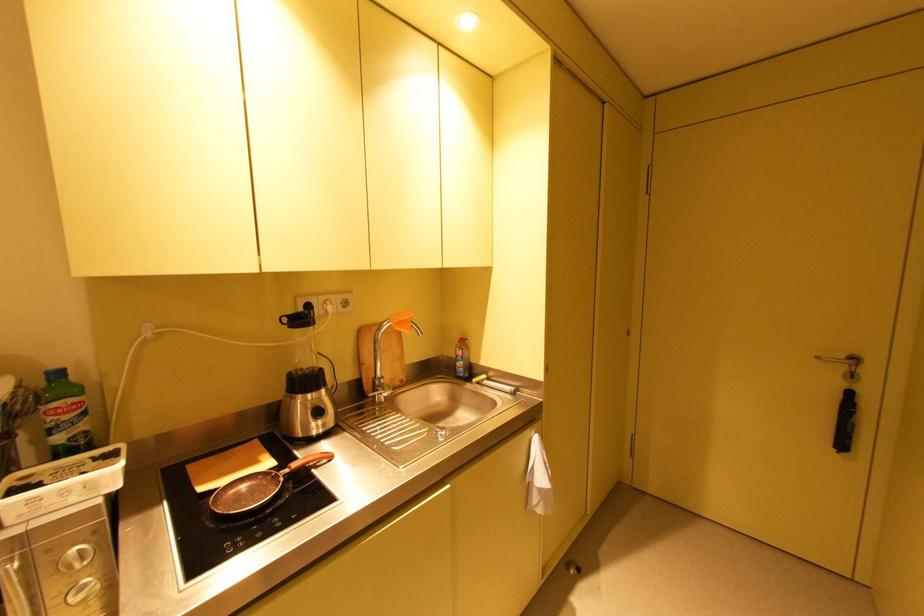
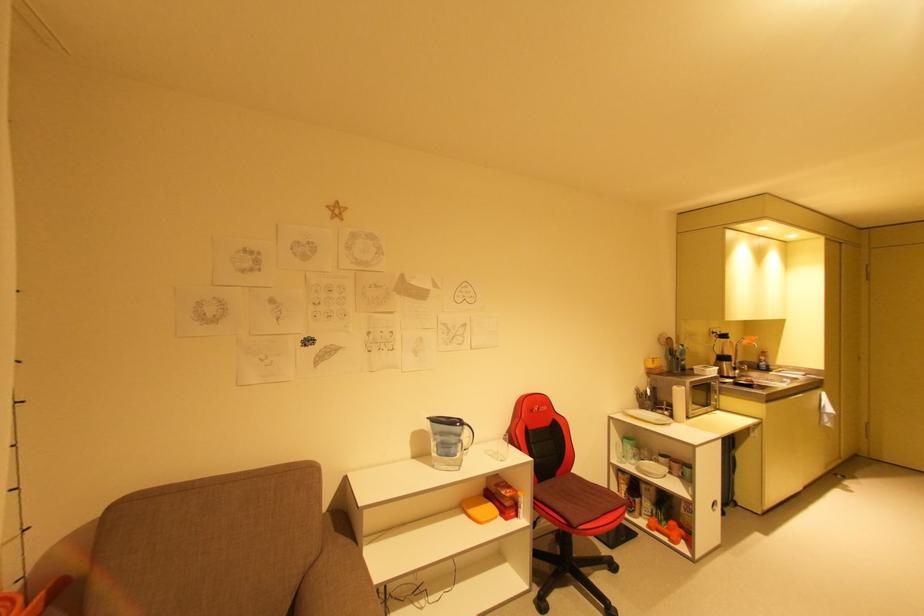
Locate, in the second image, the point that corresponds to point 472,386 in the first image.

(776, 373)